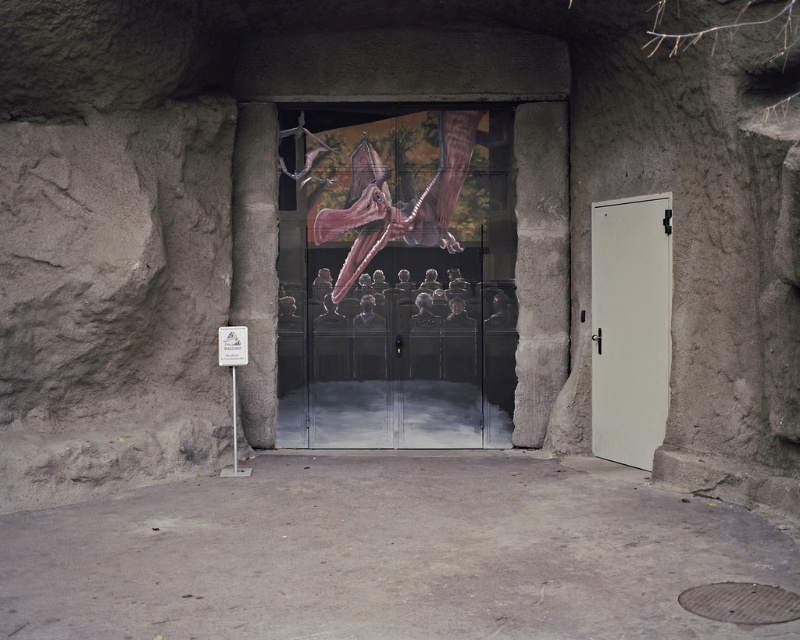
Question: Which object appears closest to the camera in this image?

Choices:
 (A) white matte door at right
 (B) transparent glass doors at center

Answer: (A)

Question: Is the position of transparent glass doors at center more distant than that of white matte door at right?

Choices:
 (A) yes
 (B) no

Answer: (A)

Question: Which of the following is the farthest from the observer?

Choices:
 (A) transparent glass doors at center
 (B) white matte door at right

Answer: (A)

Question: Is transparent glass doors at center above white matte door at right?

Choices:
 (A) no
 (B) yes

Answer: (B)

Question: Does transparent glass doors at center appear on the right side of white matte door at right?

Choices:
 (A) no
 (B) yes

Answer: (A)